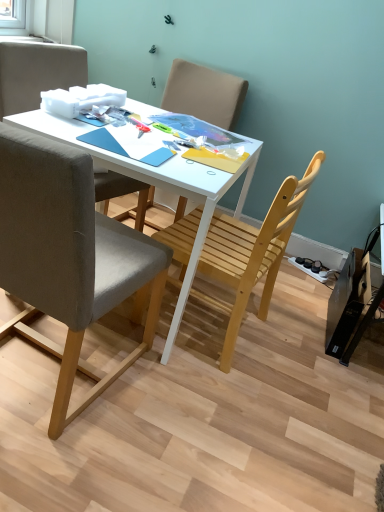
Question: In which direction should I rotate to look at light brown wooden chair at center, which is the 4th chair from front to back?

Choices:
 (A) left
 (B) right

Answer: (A)

Question: From a real-world perspective, is light brown wooden chair at center, which is the 4th chair from front to back, positioned under matte gray chair at upper left, the second chair from the back, based on gravity?

Choices:
 (A) yes
 (B) no

Answer: (B)

Question: Can you confirm if light brown wooden chair at center, which is counted as the 1th chair, starting from the back, is bigger than matte gray chair at upper left, marked as the third chair in a front-to-back arrangement?

Choices:
 (A) no
 (B) yes

Answer: (A)

Question: Considering the relative positions of light brown wooden chair at center, which is counted as the 1th chair, starting from the back, and matte gray chair at upper left, marked as the third chair in a front-to-back arrangement, in the image provided, is light brown wooden chair at center, which is counted as the 1th chair, starting from the back, to the right of matte gray chair at upper left, marked as the third chair in a front-to-back arrangement, from the viewer's perspective?

Choices:
 (A) no
 (B) yes

Answer: (B)

Question: Is light brown wooden chair at center, which is the 4th chair from front to back, next to matte gray chair at upper left, marked as the third chair in a front-to-back arrangement?

Choices:
 (A) no
 (B) yes

Answer: (A)

Question: Can we say light brown wooden chair at center, which is the 4th chair from front to back, lies outside matte gray chair at upper left, marked as the third chair in a front-to-back arrangement?

Choices:
 (A) yes
 (B) no

Answer: (A)

Question: Is light brown wooden chair at center, which is counted as the 1th chair, starting from the back, smaller than matte gray chair at upper left, marked as the third chair in a front-to-back arrangement?

Choices:
 (A) no
 (B) yes

Answer: (B)

Question: Does white matte desk at center appear on the left side of matte gray chair at upper left, the second chair from the back?

Choices:
 (A) yes
 (B) no

Answer: (B)

Question: From a real-world perspective, is white matte desk at center below matte gray chair at upper left, the second chair from the back?

Choices:
 (A) no
 (B) yes

Answer: (B)

Question: Does white matte desk at center have a greater height compared to matte gray chair at upper left, marked as the third chair in a front-to-back arrangement?

Choices:
 (A) no
 (B) yes

Answer: (B)

Question: Can you confirm if white matte desk at center is bigger than matte gray chair at upper left, marked as the third chair in a front-to-back arrangement?

Choices:
 (A) no
 (B) yes

Answer: (B)

Question: Is the depth of white matte desk at center greater than that of matte gray chair at upper left, the second chair from the back?

Choices:
 (A) no
 (B) yes

Answer: (A)

Question: Is white matte desk at center oriented towards matte gray chair at upper left, the second chair from the back?

Choices:
 (A) yes
 (B) no

Answer: (B)

Question: From the image's perspective, would you say light brown wooden chair at center, which is the 4th chair from front to back, is shown under gray fabric chair at left, which is counted as the first chair, starting from the front?

Choices:
 (A) no
 (B) yes

Answer: (A)